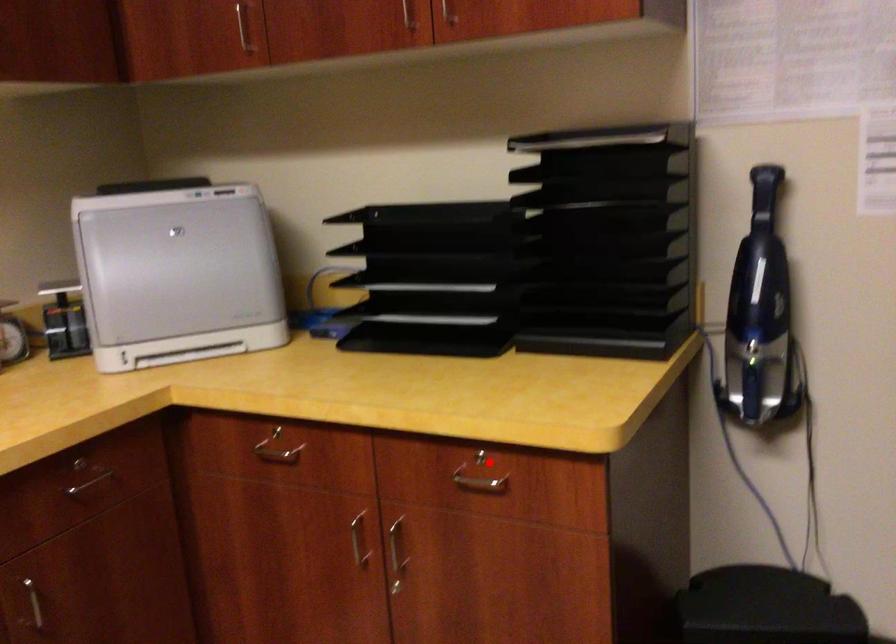
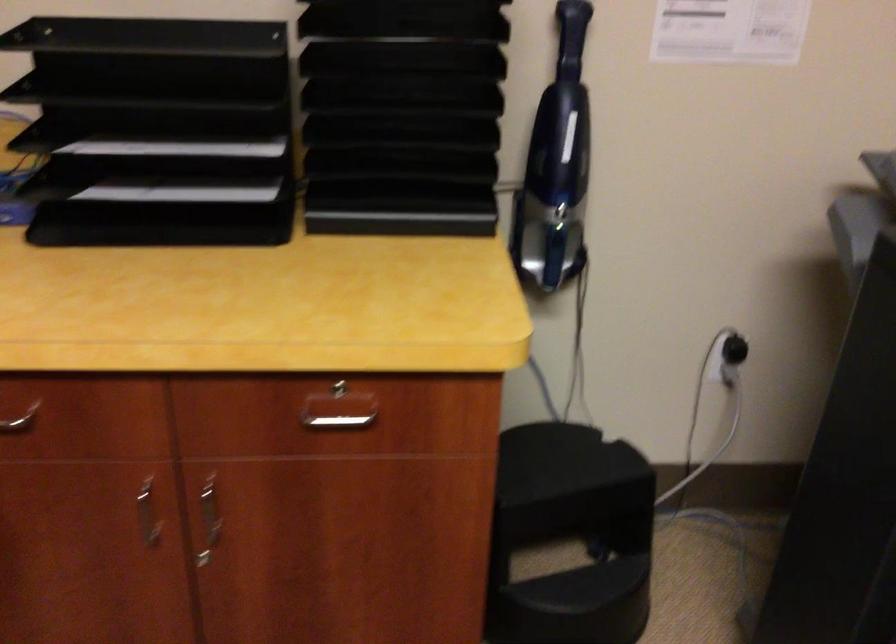
Locate, in the second image, the point that corresponds to the highlighted location in the first image.

(342, 391)